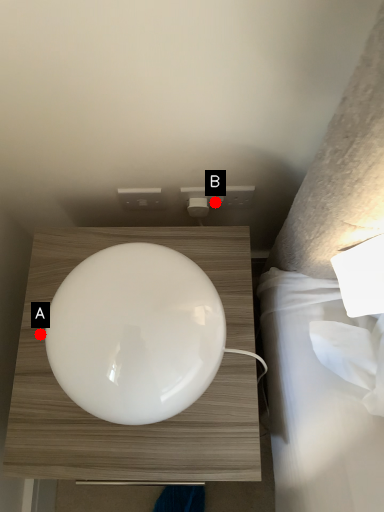
Question: Two points are circled on the image, labeled by A and B beside each circle. Which of the following is the closest to the observer?

Choices:
 (A) A is closer
 (B) B is closer

Answer: (A)